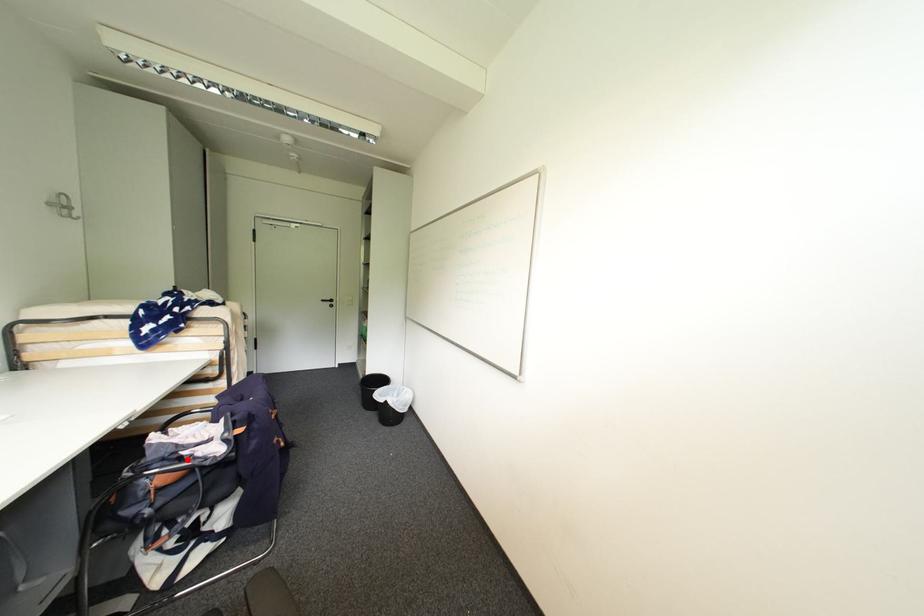
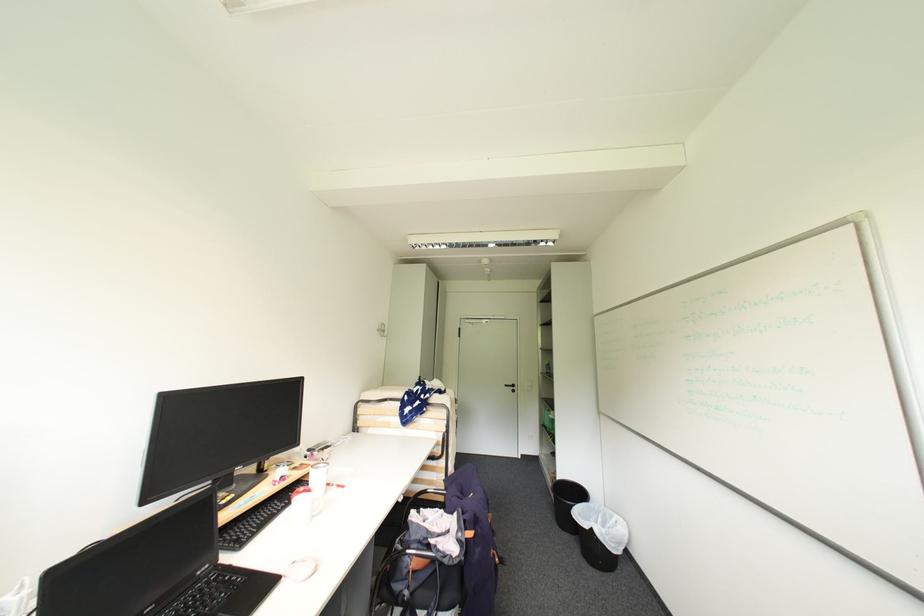
The point at the highlighted location is marked in the first image. Where is the corresponding point in the second image?

(435, 548)